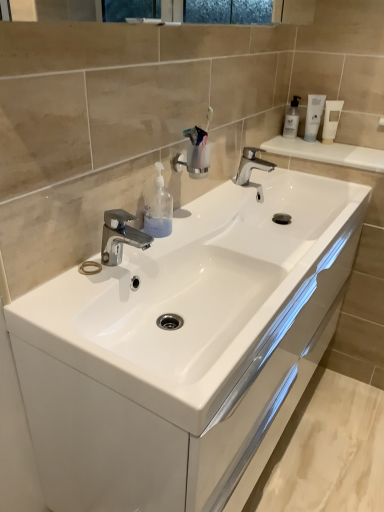
How much space does transparent plastic mouthwash at upper right, which appears as the 3th mouthwash when viewed from the right, occupy horizontally?

transparent plastic mouthwash at upper right, which appears as the 3th mouthwash when viewed from the right, is 2.85 inches in width.

What do you see at coordinates (185, 348) in the screenshot? I see `white glossy cabinet at center` at bounding box center [185, 348].

What do you see at coordinates (120, 236) in the screenshot? I see `polished chrome faucet at center, the 1th tap viewed from the front` at bounding box center [120, 236].

Describe the element at coordinates (158, 208) in the screenshot. I see `transparent plastic soap dispenser at center` at that location.

The height and width of the screenshot is (512, 384). Identify the location of transparent plastic mouthwash at upper right, which ranks as the 1th mouthwash in left-to-right order. (292, 119).

Does chrome metallic faucet at upper center, acting as the 2th tap starting from the front, have a lesser width compared to polished chrome faucet at center, arranged as the second tap when viewed from the top?

No.

Is polished chrome faucet at center, which is the first tap from left to right, completely or partially inside chrome metallic faucet at upper center, the 2th tap positioned from the left?

No, chrome metallic faucet at upper center, the 2th tap positioned from the left, does not contain polished chrome faucet at center, which is the first tap from left to right.

Is chrome metallic faucet at upper center, placed as the first tap when sorted from back to front, aimed at polished chrome faucet at center, acting as the second tap starting from the back?

No, chrome metallic faucet at upper center, placed as the first tap when sorted from back to front, does not turn towards polished chrome faucet at center, acting as the second tap starting from the back.

Is chrome metallic faucet at upper center, the 2th tap positioned from the left, at the right side of polished chrome faucet at center, arranged as the second tap when viewed from the top?

Yes.

How far apart are white glossy tube at upper right, the first mouthwash from the right, and white glossy cabinet at center?

white glossy tube at upper right, the first mouthwash from the right, and white glossy cabinet at center are 1.06 meters apart from each other.

Which point is more forward, (330, 134) or (341, 198)?

The point (341, 198) is more forward.

From the picture: Considering the sizes of white glossy tube at upper right, which ranks as the 3th mouthwash in left-to-right order, and white glossy cabinet at center in the image, is white glossy tube at upper right, which ranks as the 3th mouthwash in left-to-right order, taller or shorter than white glossy cabinet at center?

Considering their sizes, white glossy tube at upper right, which ranks as the 3th mouthwash in left-to-right order, has less height than white glossy cabinet at center.

Is white glossy tube at upper right, which ranks as the 3th mouthwash in left-to-right order, aimed at white glossy cabinet at center?

No, white glossy tube at upper right, which ranks as the 3th mouthwash in left-to-right order, does not turn towards white glossy cabinet at center.

How many degrees apart are the facing directions of white glossy mouthwash at upper right, the 2th mouthwash positioned from the right, and chrome metallic faucet at upper center, the 2th tap positioned from the left?

43.6 degrees separate the facing orientations of white glossy mouthwash at upper right, the 2th mouthwash positioned from the right, and chrome metallic faucet at upper center, the 2th tap positioned from the left.

Is white glossy mouthwash at upper right, the second mouthwash when ordered from left to right, located outside chrome metallic faucet at upper center, marked as the 2th tap in a bottom-to-top arrangement?

Yes, white glossy mouthwash at upper right, the second mouthwash when ordered from left to right, is located beyond the bounds of chrome metallic faucet at upper center, marked as the 2th tap in a bottom-to-top arrangement.

Is white glossy mouthwash at upper right, the 2th mouthwash positioned from the right, not near chrome metallic faucet at upper center, the 2th tap positioned from the left?

white glossy mouthwash at upper right, the 2th mouthwash positioned from the right, is near chrome metallic faucet at upper center, the 2th tap positioned from the left, not far away.

Would you say white glossy mouthwash at upper right, the 2th mouthwash positioned from the right, is to the left or to the right of chrome metallic faucet at upper center, placed as the first tap when sorted from back to front, in the picture?

Clearly, white glossy mouthwash at upper right, the 2th mouthwash positioned from the right, is on the right of chrome metallic faucet at upper center, placed as the first tap when sorted from back to front, in the image.

Between transparent plastic soap dispenser at center and white glossy cabinet at center, which one is positioned behind?

transparent plastic soap dispenser at center is further from the camera.

Is transparent plastic soap dispenser at center taller than white glossy cabinet at center?

Incorrect, the height of transparent plastic soap dispenser at center is not larger of that of white glossy cabinet at center.

Would you say transparent plastic soap dispenser at center is to the left or to the right of white glossy cabinet at center in the picture?

In the image, transparent plastic soap dispenser at center appears on the left side of white glossy cabinet at center.

Would you say transparent plastic soap dispenser at center is outside white glossy cabinet at center?

That's correct, transparent plastic soap dispenser at center is outside of white glossy cabinet at center.

Is polished chrome faucet at center, which is the first tap from left to right, turned away from white glossy mouthwash at upper right, the 2th mouthwash positioned from the right?

No, polished chrome faucet at center, which is the first tap from left to right, is not facing the opposite direction of white glossy mouthwash at upper right, the 2th mouthwash positioned from the right.

Which is less distant, [111,260] or [312,130]?

Positioned in front is point [111,260].

Considering the relative sizes of polished chrome faucet at center, which is counted as the 2th tap, starting from the right, and white glossy mouthwash at upper right, the 2th mouthwash positioned from the right, in the image provided, is polished chrome faucet at center, which is counted as the 2th tap, starting from the right, thinner than white glossy mouthwash at upper right, the 2th mouthwash positioned from the right,?

No.

Is point (254, 162) positioned after point (328, 298)?

Yes, point (254, 162) is farther from viewer.

Is the depth of chrome metallic faucet at upper center, marked as the 2th tap in a bottom-to-top arrangement, less than that of white glossy cabinet at center?

A: No, chrome metallic faucet at upper center, marked as the 2th tap in a bottom-to-top arrangement, is further to the viewer.

Is chrome metallic faucet at upper center, the 2th tap positioned from the left, located outside white glossy cabinet at center?

Indeed, chrome metallic faucet at upper center, the 2th tap positioned from the left, is completely outside white glossy cabinet at center.

From the image's perspective, which is above, chrome metallic faucet at upper center, acting as the 2th tap starting from the front, or white glossy cabinet at center?

chrome metallic faucet at upper center, acting as the 2th tap starting from the front, from the image's perspective.

Is white glossy cabinet at center far from white glossy tube at upper right, the first mouthwash from the right?

Indeed, white glossy cabinet at center is not near white glossy tube at upper right, the first mouthwash from the right.

From a real-world perspective, is white glossy cabinet at center positioned over white glossy tube at upper right, the first mouthwash from the right, based on gravity?

No, from a real-world perspective, white glossy cabinet at center is not above white glossy tube at upper right, the first mouthwash from the right.

Considering the positions of points (232, 478) and (332, 129), is point (232, 478) closer to camera compared to point (332, 129)?

Yes.

Is white glossy cabinet at center inside the boundaries of white glossy tube at upper right, the first mouthwash from the right, or outside?

white glossy cabinet at center is located beyond the bounds of white glossy tube at upper right, the first mouthwash from the right.

Where is `tap below the polished chrome faucet at center, acting as the second tap starting from the back (from a real-world perspective)`? Image resolution: width=384 pixels, height=512 pixels. tap below the polished chrome faucet at center, acting as the second tap starting from the back (from a real-world perspective) is located at coordinates (252, 169).

Identify the location of bathroom cabinet lying in front of the white glossy tube at upper right, which ranks as the 3th mouthwash in left-to-right order. The height and width of the screenshot is (512, 384). (185, 348).

When comparing their distances from white glossy mouthwash at upper right, the second mouthwash when ordered from left to right, does polished chrome faucet at center, which is the first tap from left to right, or transparent plastic mouthwash at upper right, which appears as the 3th mouthwash when viewed from the right, seem further?

polished chrome faucet at center, which is the first tap from left to right.

Considering their positions, is transparent plastic soap dispenser at center positioned closer to polished chrome faucet at center, which is the first tap from left to right, than chrome metallic faucet at upper center, which is counted as the 1th tap, starting from the right?

transparent plastic soap dispenser at center is positioned closer to the anchor polished chrome faucet at center, which is the first tap from left to right.

Estimate the real-world distances between objects in this image. Which object is further from transparent plastic soap dispenser at center, white glossy tube at upper right, which ranks as the 3th mouthwash in left-to-right order, or polished chrome faucet at center, arranged as the second tap when viewed from the top?

Based on the image, white glossy tube at upper right, which ranks as the 3th mouthwash in left-to-right order, appears to be further to transparent plastic soap dispenser at center.

Looking at the image, which one is located closer to white glossy mouthwash at upper right, the 2th mouthwash positioned from the right, white glossy cabinet at center or white glossy tube at upper right, the first mouthwash from the right?

white glossy tube at upper right, the first mouthwash from the right, lies closer to white glossy mouthwash at upper right, the 2th mouthwash positioned from the right, than the other object.

Based on the photo, estimate the real-world distances between objects in this image. Which object is further from white glossy cabinet at center, transparent plastic soap dispenser at center or transparent plastic mouthwash at upper right, which appears as the 3th mouthwash when viewed from the right?

transparent plastic mouthwash at upper right, which appears as the 3th mouthwash when viewed from the right.

Which object lies nearer to the anchor point polished chrome faucet at center, acting as the second tap starting from the back, white glossy cabinet at center or white glossy tube at upper right, which ranks as the 3th mouthwash in left-to-right order?

white glossy cabinet at center lies closer to polished chrome faucet at center, acting as the second tap starting from the back, than the other object.

In the scene shown: Estimate the real-world distances between objects in this image. Which object is closer to transparent plastic soap dispenser at center, chrome metallic faucet at upper center, acting as the 2th tap starting from the front, or transparent plastic mouthwash at upper right, which appears as the 3th mouthwash when viewed from the right?

Based on the image, chrome metallic faucet at upper center, acting as the 2th tap starting from the front, appears to be nearer to transparent plastic soap dispenser at center.

When comparing their distances from white glossy tube at upper right, the first mouthwash from the right, does transparent plastic mouthwash at upper right, which ranks as the 1th mouthwash in left-to-right order, or transparent plastic soap dispenser at center seem further?

Based on the image, transparent plastic soap dispenser at center appears to be further to white glossy tube at upper right, the first mouthwash from the right.

Image resolution: width=384 pixels, height=512 pixels. What are the coordinates of `soap dispenser between white glossy cabinet at center and chrome metallic faucet at upper center, the 2th tap positioned from the left, from front to back` in the screenshot? It's located at [158, 208].

The width and height of the screenshot is (384, 512). Find the location of `tap between polished chrome faucet at center, arranged as the second tap when viewed from the top, and white glossy mouthwash at upper right, the second mouthwash when ordered from left to right, along the z-axis`. tap between polished chrome faucet at center, arranged as the second tap when viewed from the top, and white glossy mouthwash at upper right, the second mouthwash when ordered from left to right, along the z-axis is located at coordinates (252, 169).

The image size is (384, 512). I want to click on tap located between transparent plastic soap dispenser at center and transparent plastic mouthwash at upper right, which ranks as the 1th mouthwash in left-to-right order, in the depth direction, so click(x=252, y=169).

You are a GUI agent. You are given a task and a screenshot of the screen. Output one action in this format:
    pyautogui.click(x=<x>, y=<y>)
    Task: Click on the soap dispenser located between white glossy cabinet at center and transparent plastic mouthwash at upper right, which ranks as the 1th mouthwash in left-to-right order, in the depth direction
    
    Given the screenshot: What is the action you would take?
    pyautogui.click(x=158, y=208)